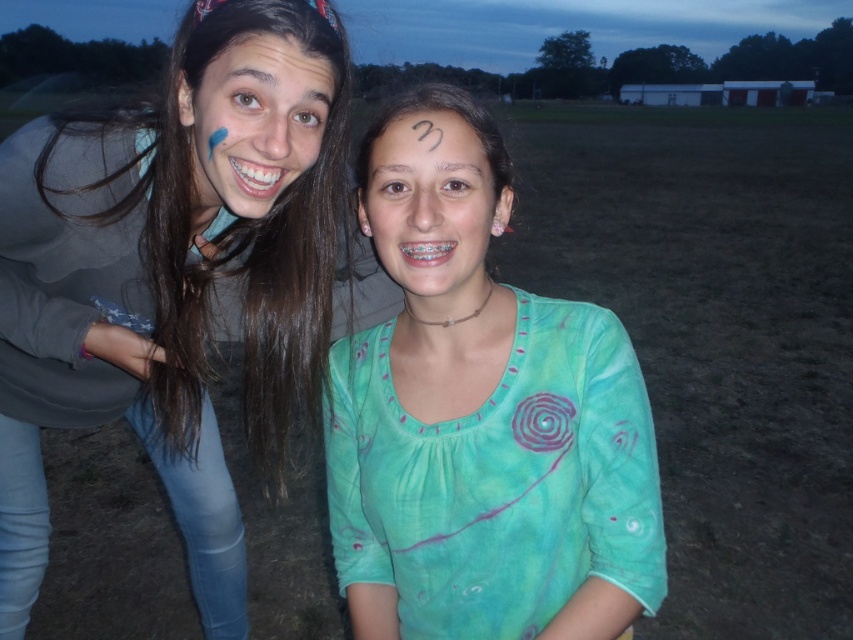
You are a photographer setting up for a group photo. You notice the matte gray sweatshirt at left and the smooth skin forehead at center in your frame. Which object is closer to you in the current composition?

The matte gray sweatshirt at left is closer to you than the smooth skin forehead at center in the current composition.

You are an artist observing the scene. You need to paint the matte green shirt at center and the matte blue paint at left. Which object is positioned lower in the image?

The matte green shirt at center is positioned below the matte blue paint at left, so it is lower in the image.